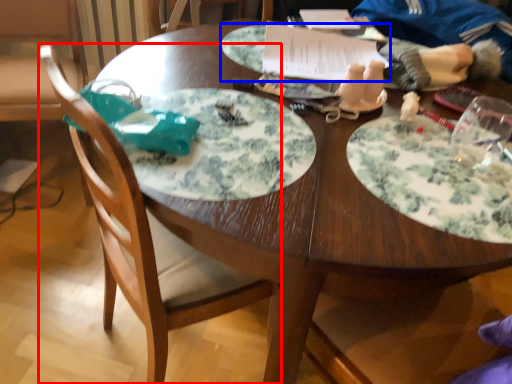
Question: Which object is further to the camera taking this photo, chair (highlighted by a red box) or platter (highlighted by a blue box)?

Choices:
 (A) chair
 (B) platter

Answer: (B)